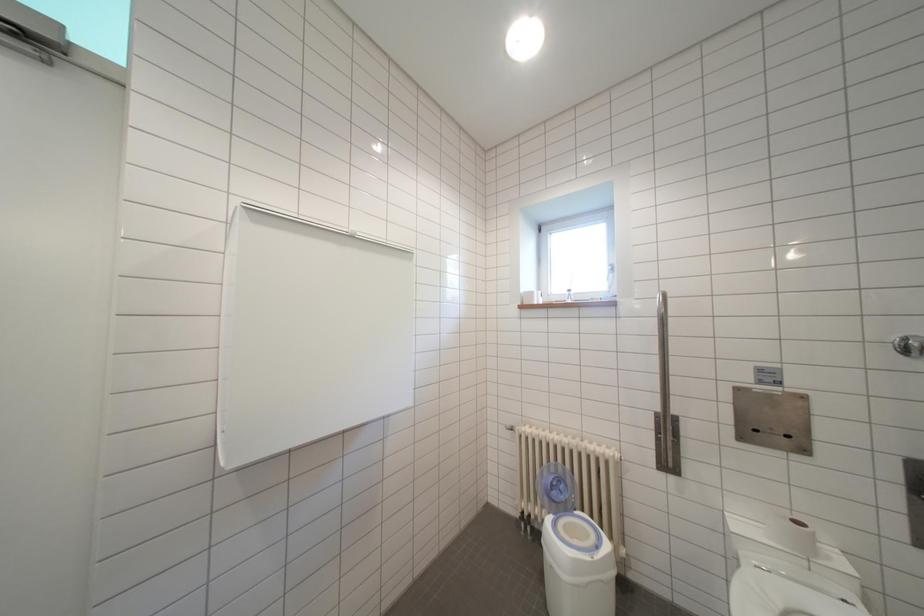
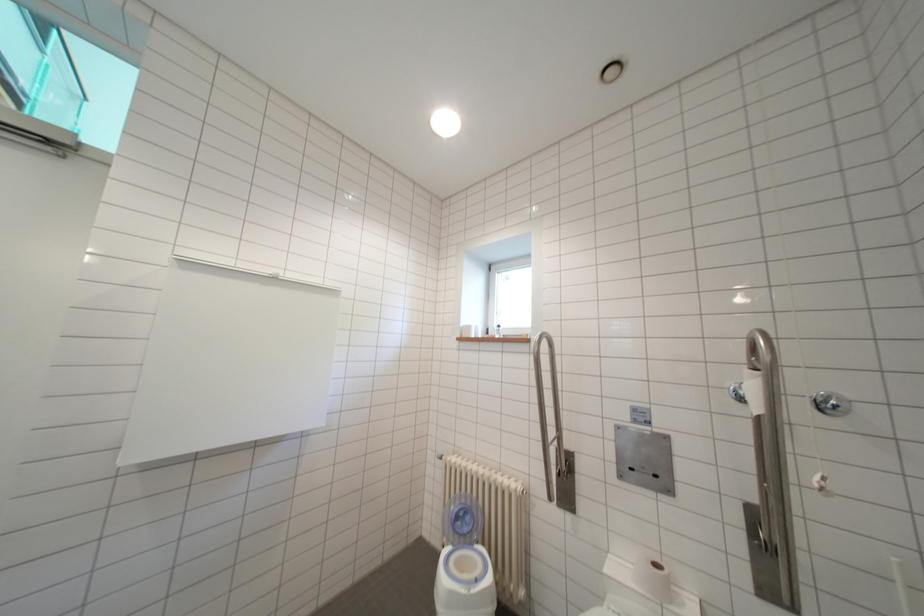
Question: Based on the continuous images, in which direction is the camera rotating? Reply with the corresponding letter.

Choices:
 (A) Left
 (B) Right
 (C) Up
 (D) Down

Answer: (C)